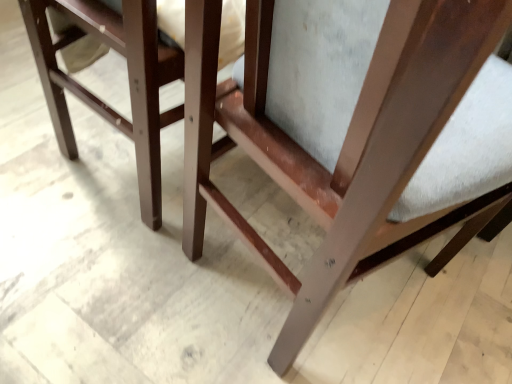
Question: Does point (196, 36) appear closer or farther from the camera than point (126, 51)?

Choices:
 (A) farther
 (B) closer

Answer: (B)

Question: Is matte wood chair at center wider or thinner than matte wood chair at center?

Choices:
 (A) thin
 (B) wide

Answer: (B)

Question: Would you say matte wood chair at center is inside or outside matte wood chair at center?

Choices:
 (A) outside
 (B) inside

Answer: (A)

Question: From a real-world perspective, relative to matte wood chair at center, is matte wood chair at center vertically above or below?

Choices:
 (A) above
 (B) below

Answer: (B)

Question: In terms of height, does matte wood chair at center look taller or shorter compared to matte wood chair at center?

Choices:
 (A) tall
 (B) short

Answer: (B)

Question: In the image, is matte wood chair at center on the left side or the right side of matte wood chair at center?

Choices:
 (A) left
 (B) right

Answer: (A)

Question: Based on their sizes in the image, would you say matte wood chair at center is bigger or smaller than matte wood chair at center?

Choices:
 (A) small
 (B) big

Answer: (A)